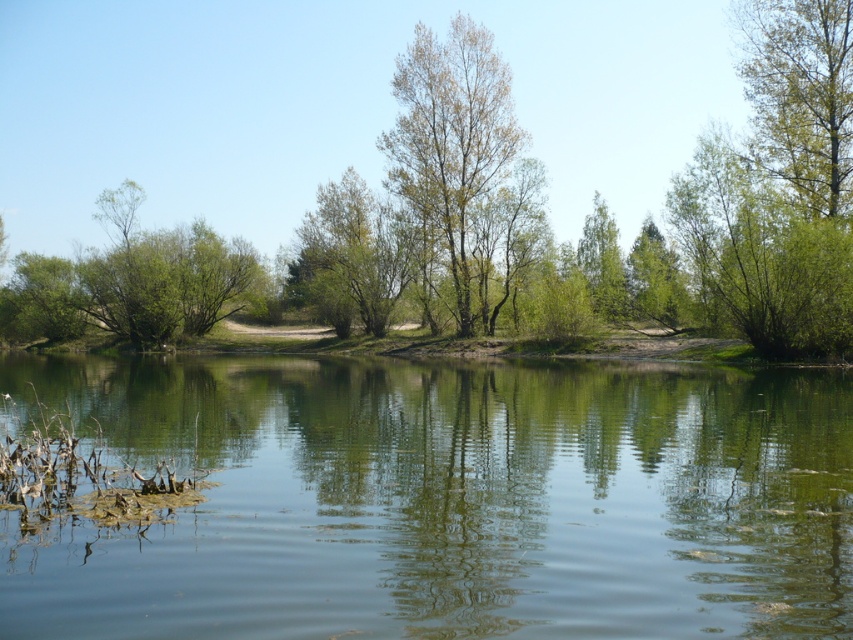
Question: Which point is closer to the camera taking this photo?

Choices:
 (A) (758, 97)
 (B) (288, 589)
 (C) (97, 300)

Answer: (B)

Question: Which point is closer to the camera?

Choices:
 (A) green reflective water at center
 (B) green leafy tree at center
 (C) green leafy tree at upper right

Answer: (A)

Question: Estimate the real-world distances between objects in this image. Which object is closer to the green leafy tree at center?

Choices:
 (A) green reflective water at center
 (B) green leafy tree at upper right
 (C) green leafy bush at left

Answer: (B)

Question: Is green leafy bush at left below green leafy tree at upper right?

Choices:
 (A) yes
 (B) no

Answer: (A)

Question: Does green leafy tree at center have a larger size compared to green leafy bush at left?

Choices:
 (A) no
 (B) yes

Answer: (B)

Question: Does green leafy bush at left appear on the left side of green leafy tree at upper right?

Choices:
 (A) yes
 (B) no

Answer: (A)